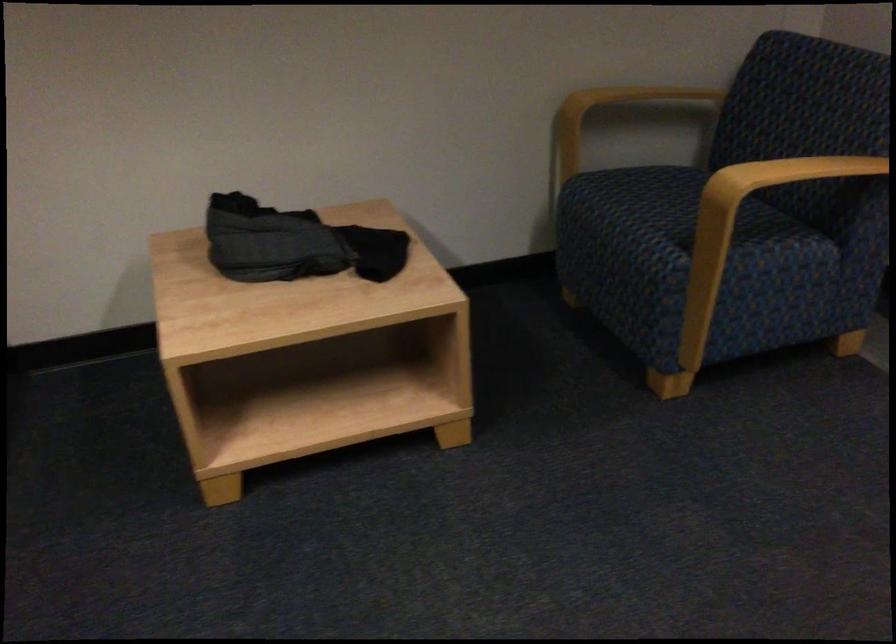
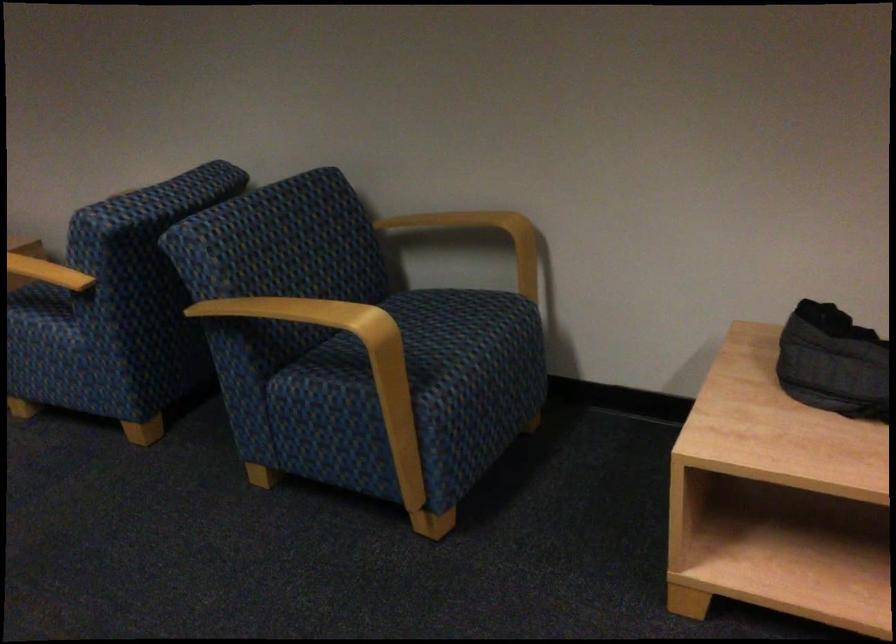
Question: The images are taken continuously from a first-person perspective. In which direction is your viewpoint rotating?

Choices:
 (A) Left
 (B) Right
 (C) Up
 (D) Down

Answer: (A)